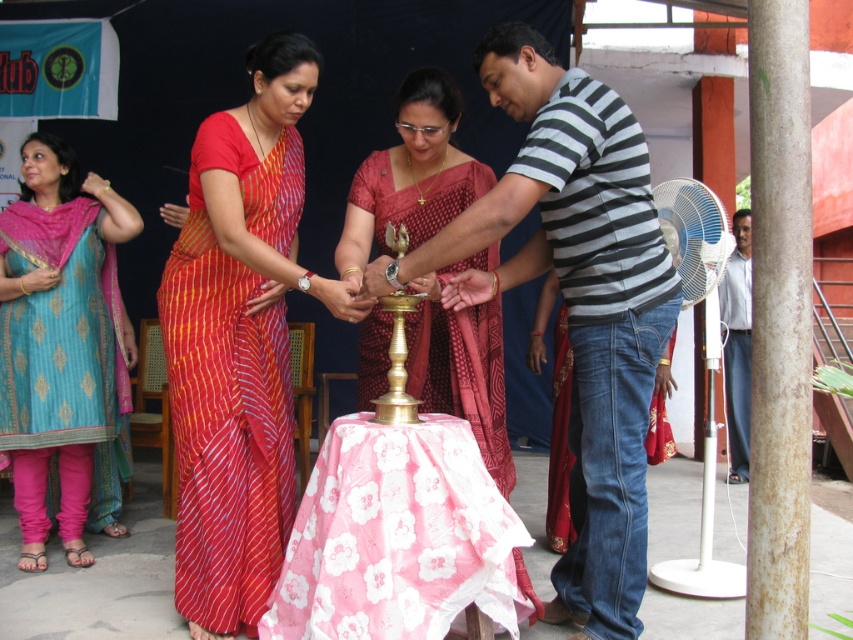
You are a photographer standing in front of the ceremonial scene. You want to take a photo that includes both point A at point (613, 358) and point B at point (280, 621). Which point is closer to your camera?

Point A at point (613, 358) is closer to the camera than point B at point (280, 621).

In the ceremonial scene, there is a striped cotton shirt at center and a pink floral fabric at center. Which one is positioned higher?

The striped cotton shirt at center is above the pink floral fabric at center, so it is positioned higher.